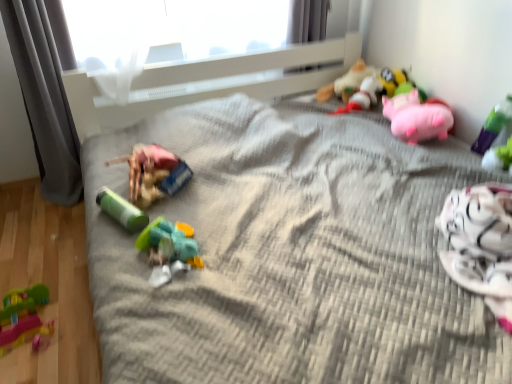
Question: Is gray fabric curtain at left, which is the first curtain in left-to-right order, shorter than rubber duck at center, acting as the third toy starting from the left?

Choices:
 (A) yes
 (B) no

Answer: (B)

Question: Can you confirm if gray fabric curtain at left, which appears as the 2th curtain when viewed from the right, is smaller than rubber duck at center, acting as the third toy starting from the left?

Choices:
 (A) no
 (B) yes

Answer: (A)

Question: Is rubber duck at center, the fifth toy viewed from the right, at the back of gray fabric curtain at left, which appears as the 2th curtain when viewed from the right?

Choices:
 (A) no
 (B) yes

Answer: (A)

Question: Is gray fabric curtain at left, which appears as the 2th curtain when viewed from the right, outside of rubber duck at center, acting as the third toy starting from the left?

Choices:
 (A) yes
 (B) no

Answer: (A)

Question: Can you confirm if gray fabric curtain at left, which is the first curtain in left-to-right order, is taller than rubber duck at center, the fifth toy viewed from the right?

Choices:
 (A) no
 (B) yes

Answer: (B)

Question: Is gray fabric curtain at left, which appears as the 2th curtain when viewed from the right, wider than rubber duck at center, the fifth toy viewed from the right?

Choices:
 (A) yes
 (B) no

Answer: (B)

Question: From a real-world perspective, is rubberized green and pink toy at lower left, the 1th toy when ordered from left to right, located higher than gray fabric curtain at left, which appears as the 2th curtain when viewed from the right?

Choices:
 (A) yes
 (B) no

Answer: (B)

Question: Is gray fabric curtain at left, which appears as the 2th curtain when viewed from the right, at the back of rubberized green and pink toy at lower left, the 1th toy when ordered from left to right?

Choices:
 (A) no
 (B) yes

Answer: (A)

Question: From a real-world perspective, is rubberized green and pink toy at lower left, the 1th toy when ordered from left to right, positioned under gray fabric curtain at left, which is the first curtain in left-to-right order, based on gravity?

Choices:
 (A) no
 (B) yes

Answer: (B)

Question: Does rubberized green and pink toy at lower left, which appears as the 7th toy when viewed from the right, have a greater height compared to gray fabric curtain at left, which is the first curtain in left-to-right order?

Choices:
 (A) yes
 (B) no

Answer: (B)

Question: Is the position of rubberized green and pink toy at lower left, which appears as the 7th toy when viewed from the right, less distant than that of gray fabric curtain at left, which appears as the 2th curtain when viewed from the right?

Choices:
 (A) no
 (B) yes

Answer: (B)

Question: Is rubberized green and pink toy at lower left, which appears as the 7th toy when viewed from the right, not within gray fabric curtain at left, which appears as the 2th curtain when viewed from the right?

Choices:
 (A) no
 (B) yes

Answer: (B)

Question: Does pink plush pig at upper right, which is the third toy in right-to-left order, come behind green plastic toy at upper right, marked as the 7th toy in a left-to-right arrangement?

Choices:
 (A) no
 (B) yes

Answer: (B)